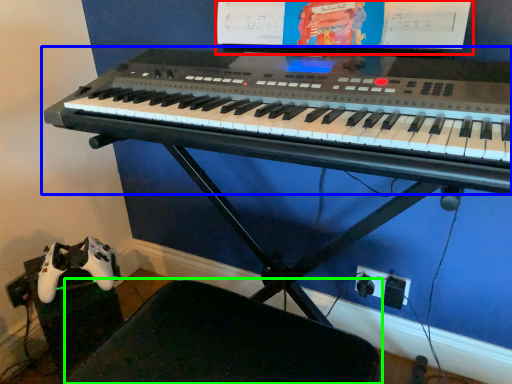
Question: Which is farther away from computer monitor (highlighted by a red box)? musical keyboard (highlighted by a blue box) or swivel chair (highlighted by a green box)?

Choices:
 (A) musical keyboard
 (B) swivel chair

Answer: (B)